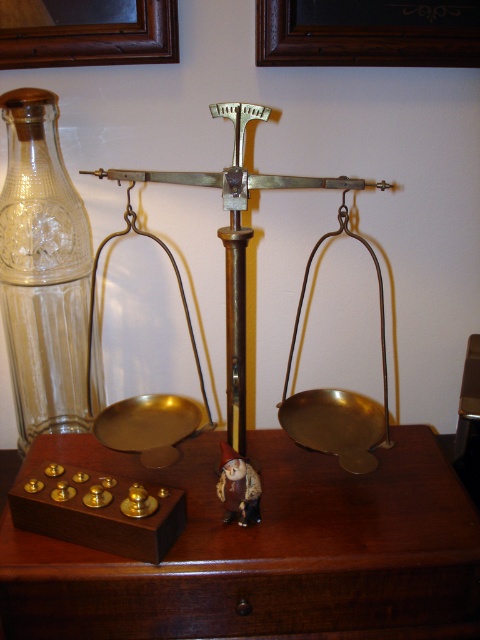
Question: In this image, where is brown wooden table at center located relative to matte brown figurine at center?

Choices:
 (A) below
 (B) above

Answer: (A)

Question: Does dark brown wood drawer at lower center have a lesser width compared to brass/bronze scale at center?

Choices:
 (A) no
 (B) yes

Answer: (A)

Question: Which object is farther from the camera taking this photo?

Choices:
 (A) brown wooden table at center
 (B) wooden picture frame at upper center
 (C) clear glass bottle at left
 (D) dark brown wood drawer at lower center

Answer: (B)

Question: Estimate the real-world distances between objects in this image. Which object is closer to the clear glass bottle at left?

Choices:
 (A) brown wooden picture frame at upper left
 (B) wooden picture frame at upper center
 (C) brass/bronze scale at center

Answer: (C)

Question: Which point is closer to the camera?

Choices:
 (A) [x=44, y=90]
 (B) [x=180, y=614]
 (C) [x=380, y=54]
 (D) [x=117, y=621]

Answer: (B)

Question: Is dark brown wood drawer at lower center above brass/bronze scale at center?

Choices:
 (A) yes
 (B) no

Answer: (B)